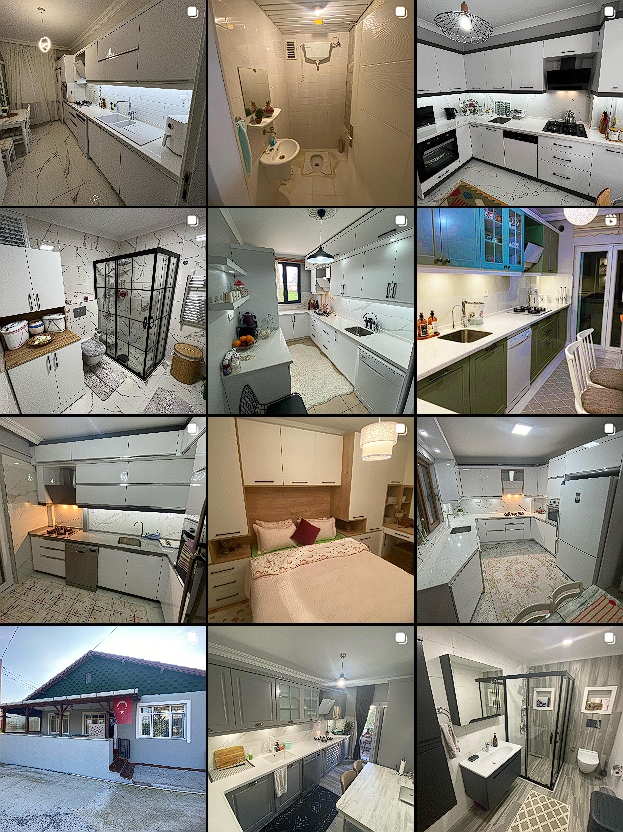
I want to click on grey kitchen cabinets, so click(x=255, y=696), click(x=215, y=714), click(x=255, y=790), click(x=298, y=773).